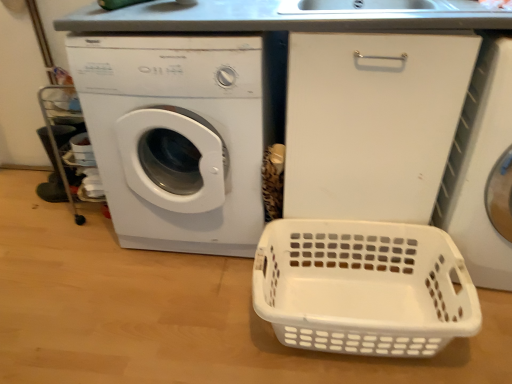
I want to click on vacant area situated to the left side of white plastic basket at lower right, so click(x=190, y=321).